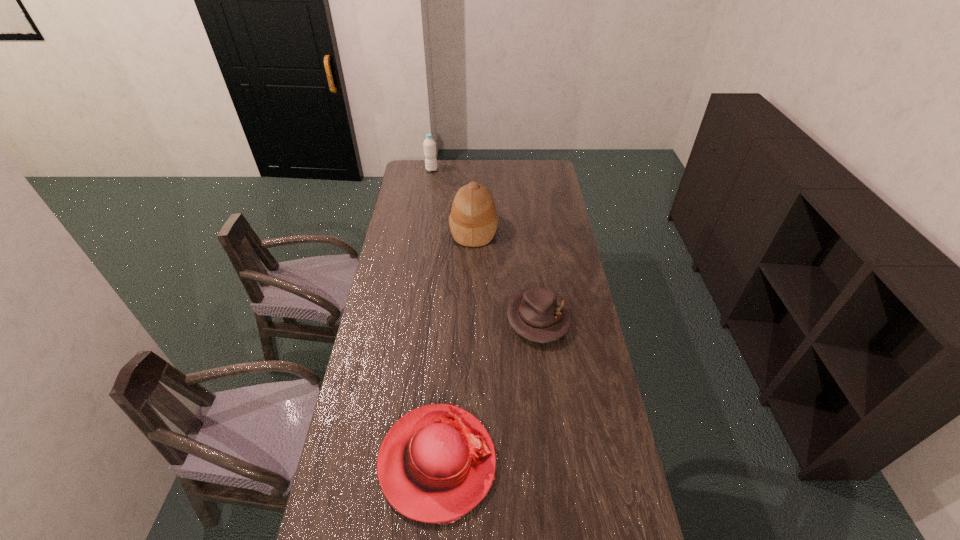
In order to click on vacant region located on the decorative side of the second farthest hat in this screenshot , I will do `click(554, 448)`.

Image resolution: width=960 pixels, height=540 pixels. What are the coordinates of `object positioned at the far edge` in the screenshot? It's located at (429, 144).

At what (x,y) coordinates should I click in order to perform the action: click on water bottle that is positioned at the left edge. Please return your answer as a coordinate pair (x, y). Looking at the image, I should click on (429, 144).

Find the location of a particular element. hat present at the left edge is located at coordinates (437, 462).

Locate an element on the screen. object present at the right edge is located at coordinates (537, 314).

Identify the location of object situated at the far left corner. (429, 144).

In the image, there is a desktop. Where is `vacant space at the far edge`? The width and height of the screenshot is (960, 540). vacant space at the far edge is located at coordinates (476, 160).

Locate an element on the screen. Image resolution: width=960 pixels, height=540 pixels. vacant space at the left edge of the desktop is located at coordinates (412, 213).

Locate an element on the screen. The height and width of the screenshot is (540, 960). free space at the right edge of the desktop is located at coordinates (549, 228).

Identify the location of free space between the water bottle and the farthest hat. The image size is (960, 540). (452, 199).